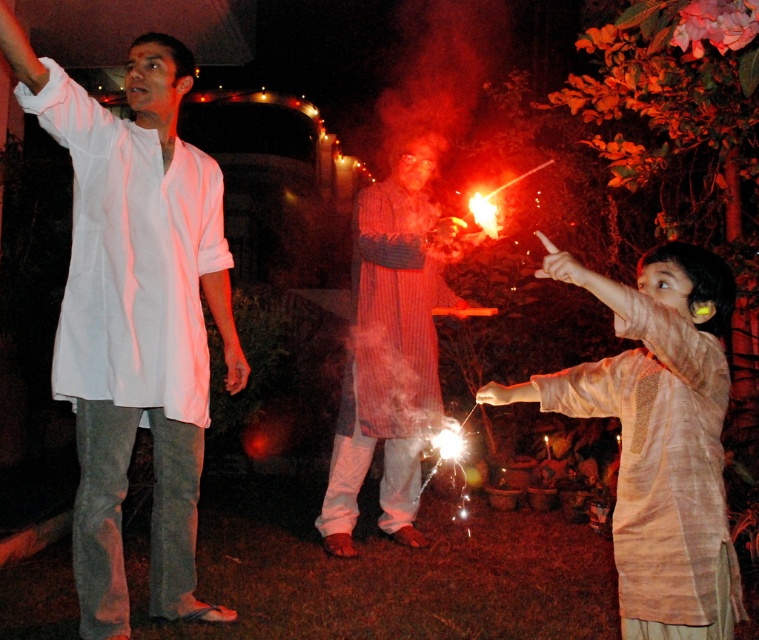
Question: Which point is farther from the camera taking this photo?

Choices:
 (A) (197, 216)
 (B) (383, 211)

Answer: (B)

Question: Does white cotton shirt at upper left have a lesser width compared to striped cotton robe at center?

Choices:
 (A) yes
 (B) no

Answer: (A)

Question: Does matte beige kurta at right lie behind striped cotton robe at center?

Choices:
 (A) no
 (B) yes

Answer: (A)

Question: Is white cotton shirt at upper left positioned at the back of matte beige kurta at right?

Choices:
 (A) yes
 (B) no

Answer: (A)

Question: Considering the real-world distances, which object is closest to the striped cotton robe at center?

Choices:
 (A) white cotton shirt at upper left
 (B) matte beige kurta at right

Answer: (A)

Question: Among these objects, which one is nearest to the camera?

Choices:
 (A) white cotton shirt at upper left
 (B) striped cotton robe at center

Answer: (A)